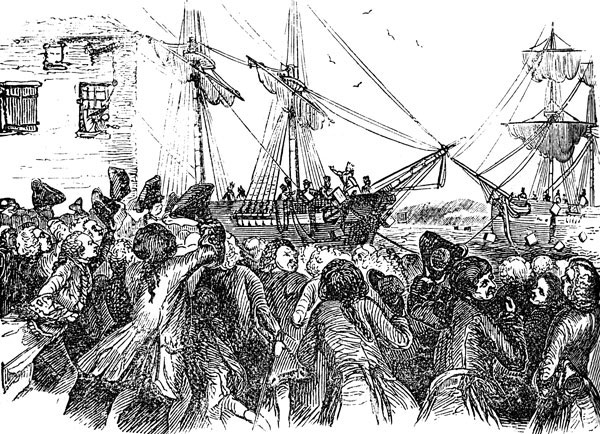
Where is `window`? Image resolution: width=600 pixels, height=434 pixels. window is located at coordinates (21, 107), (91, 99), (61, 55).